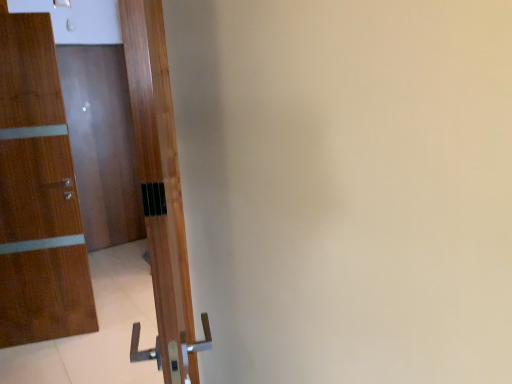
Question: Does wooden door at left, the second door viewed from the left, appear on the left side of wooden door at left, placed as the 1th door when sorted from front to back?

Choices:
 (A) no
 (B) yes

Answer: (B)

Question: Is wooden door at left, the second door from the back, located outside wooden door at left, acting as the third door starting from the left?

Choices:
 (A) yes
 (B) no

Answer: (A)

Question: Is wooden door at left, positioned as the third door in back-to-front order, located within wooden door at left, the second door positioned from the right?

Choices:
 (A) yes
 (B) no

Answer: (B)

Question: Does wooden door at left, the second door from the back, turn towards wooden door at left, placed as the 1th door when sorted from front to back?

Choices:
 (A) no
 (B) yes

Answer: (A)

Question: From a real-world perspective, is wooden door at left, the second door positioned from the right, positioned under wooden door at left, placed as the 1th door when sorted from front to back, based on gravity?

Choices:
 (A) yes
 (B) no

Answer: (A)

Question: Is point (42, 44) closer or farther from the camera than point (66, 77)?

Choices:
 (A) farther
 (B) closer

Answer: (B)

Question: Considering their positions, is wooden door at left, the second door from the back, located in front of or behind glossy wood door at left, the 3th door when ordered from right to left?

Choices:
 (A) behind
 (B) front

Answer: (B)

Question: Considering the positions of wooden door at left, the second door from the back, and glossy wood door at left, which is counted as the 3th door, starting from the front, in the image, is wooden door at left, the second door from the back, wider or thinner than glossy wood door at left, which is counted as the 3th door, starting from the front,?

Choices:
 (A) thin
 (B) wide

Answer: (B)

Question: Based on their positions, is wooden door at left, the second door positioned from the right, located to the left or right of glossy wood door at left, acting as the 1th door starting from the back?

Choices:
 (A) left
 (B) right

Answer: (B)

Question: Based on their sizes in the image, would you say glossy wood door at left, which is counted as the 3th door, starting from the front, is bigger or smaller than wooden door at left, positioned as the third door in back-to-front order?

Choices:
 (A) small
 (B) big

Answer: (A)

Question: Choose the correct answer: Is glossy wood door at left, which is the 1th door in left-to-right order, inside wooden door at left, which ranks as the 1th door in right-to-left order, or outside it?

Choices:
 (A) inside
 (B) outside

Answer: (B)

Question: Is glossy wood door at left, which is the 1th door in left-to-right order, to the left or to the right of wooden door at left, acting as the third door starting from the left, in the image?

Choices:
 (A) right
 (B) left

Answer: (B)

Question: Looking at their shapes, would you say glossy wood door at left, which is counted as the 3th door, starting from the front, is wider or thinner than wooden door at left, acting as the third door starting from the left?

Choices:
 (A) wide
 (B) thin

Answer: (B)

Question: Considering the positions of wooden door at left, the second door from the back, and wooden door at left, positioned as the third door in back-to-front order, in the image, is wooden door at left, the second door from the back, wider or thinner than wooden door at left, positioned as the third door in back-to-front order,?

Choices:
 (A) thin
 (B) wide

Answer: (A)

Question: Considering their positions, is wooden door at left, the second door positioned from the right, located in front of or behind wooden door at left, positioned as the third door in back-to-front order?

Choices:
 (A) behind
 (B) front

Answer: (A)